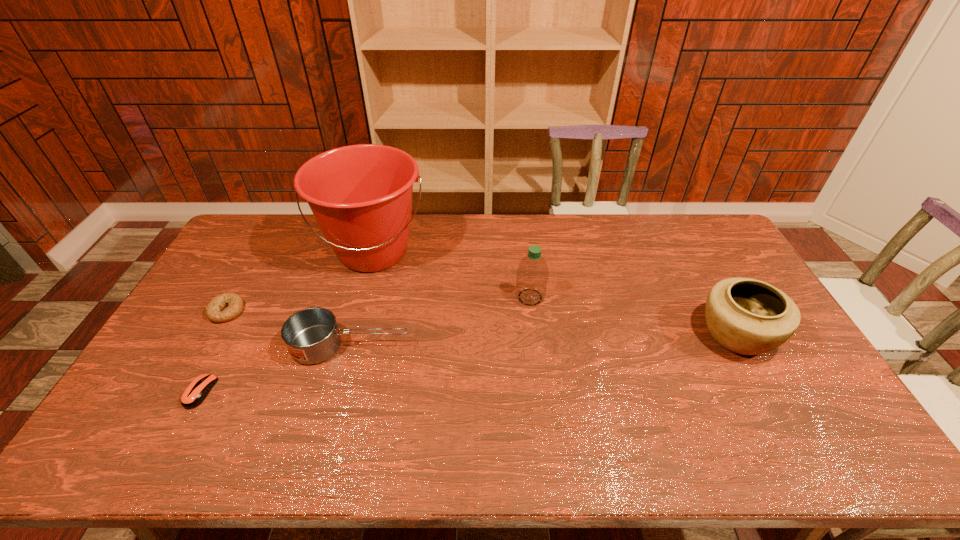
In the image, there is a desktop. In order to click on vacant space at the near edge in this screenshot , I will do `click(638, 448)`.

In the image, there is a desktop. At what (x,y) coordinates should I click in order to perform the action: click on vacant space at the left edge. Please return your answer as a coordinate pair (x, y). Image resolution: width=960 pixels, height=540 pixels. Looking at the image, I should click on (214, 357).

Find the location of `free space at the right edge`. free space at the right edge is located at coordinates (724, 265).

This screenshot has width=960, height=540. What are the coordinates of `vacant point at the near left corner` in the screenshot? It's located at (114, 450).

This screenshot has width=960, height=540. I want to click on vacant area at the far right corner of the desktop, so click(685, 214).

Identify the location of empty location between the computer mouse and the fifth tallest object. The width and height of the screenshot is (960, 540). (213, 352).

Where is `vacant region between the water bottle and the tallest object`? vacant region between the water bottle and the tallest object is located at coordinates (452, 274).

Locate an element on the screen. The height and width of the screenshot is (540, 960). vacant area that lies between the bucket and the fourth tallest object is located at coordinates (362, 299).

This screenshot has width=960, height=540. In order to click on free space that is in between the tallest object and the rightmost object in this screenshot , I will do `click(555, 293)`.

This screenshot has height=540, width=960. I want to click on free space between the rightmost object and the water bottle, so click(x=634, y=316).